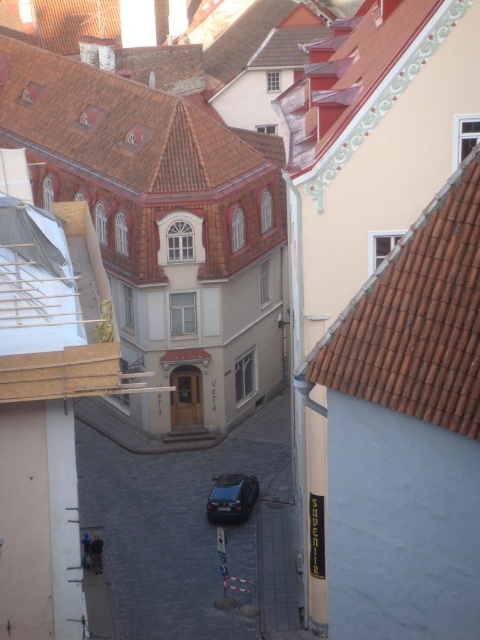
Is point (228, 529) farther from camera compared to point (205, 134)?

No, (228, 529) is closer to viewer.

The width and height of the screenshot is (480, 640). What do you see at coordinates (191, 528) in the screenshot? I see `dark gray cobblestone alley at center` at bounding box center [191, 528].

The image size is (480, 640). Identify the location of dark gray cobblestone alley at center. (191, 528).

You are a GUI agent. You are given a task and a screenshot of the screen. Output one action in this format:
    pyautogui.click(x=<x>, y=<y>)
    Task: Click on the dark gray cobblestone alley at center
    The width and height of the screenshot is (480, 640).
    Given the screenshot: What is the action you would take?
    pyautogui.click(x=191, y=528)

Does point (3, 138) come behind point (229, 477)?

Yes, point (3, 138) is farther from viewer.

What do you see at coordinates (116, 125) in the screenshot? I see `brown tiled roof at upper center` at bounding box center [116, 125].

Which is behind, point (164, 163) or point (225, 516)?

The point (164, 163) is more distant.

At what (x,y) coordinates should I click in order to perform the action: click on brown tiled roof at upper center. Please return your answer as a coordinate pair (x, y). Image resolution: width=480 pixels, height=640 pixels. Looking at the image, I should click on (116, 125).

Which is above, brown tile roof at upper right or brown tiled roof at upper center?

Positioned higher is brown tiled roof at upper center.

What do you see at coordinates (417, 317) in the screenshot? I see `brown tile roof at upper right` at bounding box center [417, 317].

Is point (440, 353) in front of point (140, 160)?

Yes, point (440, 353) is closer to viewer.

Find the location of a particular element. brown tile roof at upper right is located at coordinates (x=417, y=317).